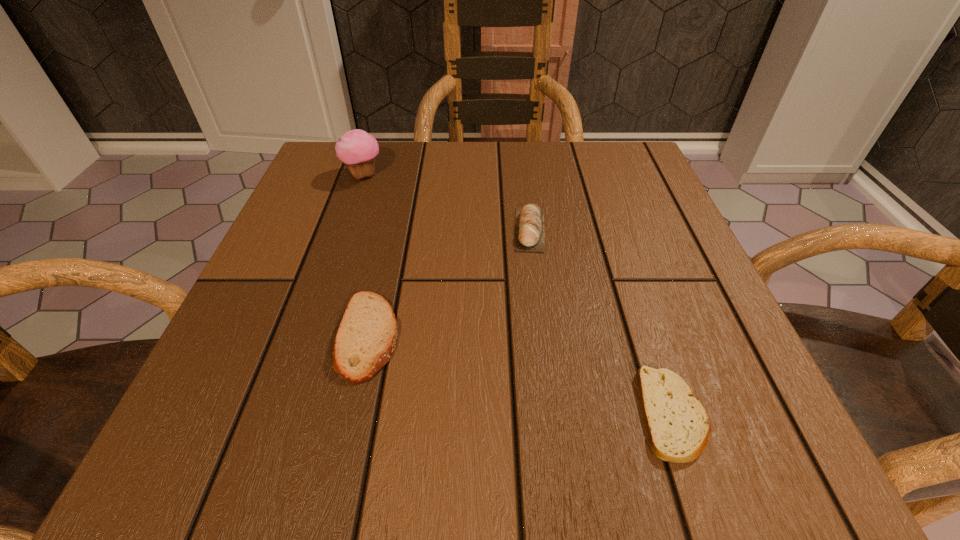
At what (x,y) coordinates should I click in order to perform the action: click on free space located 0.270m on the back of the leftmost pita bread. Please return your answer as a coordinate pair (x, y). This screenshot has height=540, width=960. Looking at the image, I should click on (399, 197).

Find the location of a particular element. The width and height of the screenshot is (960, 540). free space located 0.400m on the back of the shortest pita bread is located at coordinates (601, 200).

The width and height of the screenshot is (960, 540). Identify the location of object that is positioned at the far edge. (356, 148).

Where is `object that is at the near edge`? The image size is (960, 540). object that is at the near edge is located at coordinates (677, 424).

Locate an element on the screen. The height and width of the screenshot is (540, 960). object that is positioned at the left edge is located at coordinates (356, 148).

Find the location of a particular element. This screenshot has height=540, width=960. object present at the right edge is located at coordinates (677, 424).

Locate an element on the screen. object present at the far left corner is located at coordinates (356, 148).

At what (x,y) coordinates should I click in order to perform the action: click on object present at the near right corner. Please return your answer as a coordinate pair (x, y). The width and height of the screenshot is (960, 540). Looking at the image, I should click on (677, 424).

Locate an element on the screen. Image resolution: width=960 pixels, height=540 pixels. free location at the far edge of the desktop is located at coordinates (434, 146).

Find the location of a particular element. This screenshot has height=540, width=960. free spot at the near edge of the desktop is located at coordinates (335, 446).